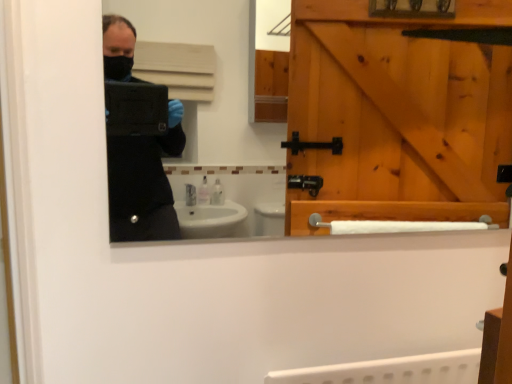
The image size is (512, 384). Identify the location of wooden door at center. (398, 115).

This screenshot has height=384, width=512. What do you see at coordinates (398, 115) in the screenshot? I see `wooden door at center` at bounding box center [398, 115].

I want to click on wooden door at center, so click(398, 115).